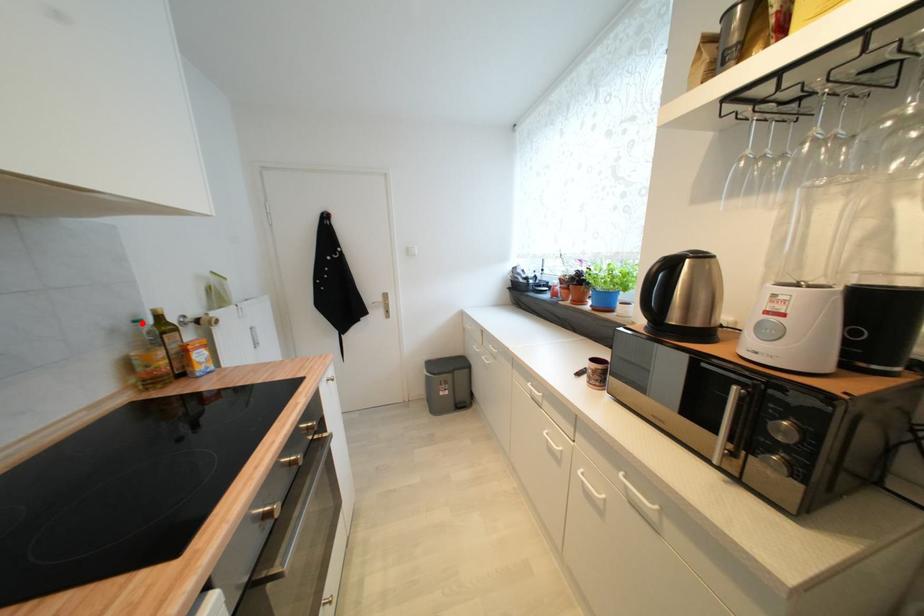
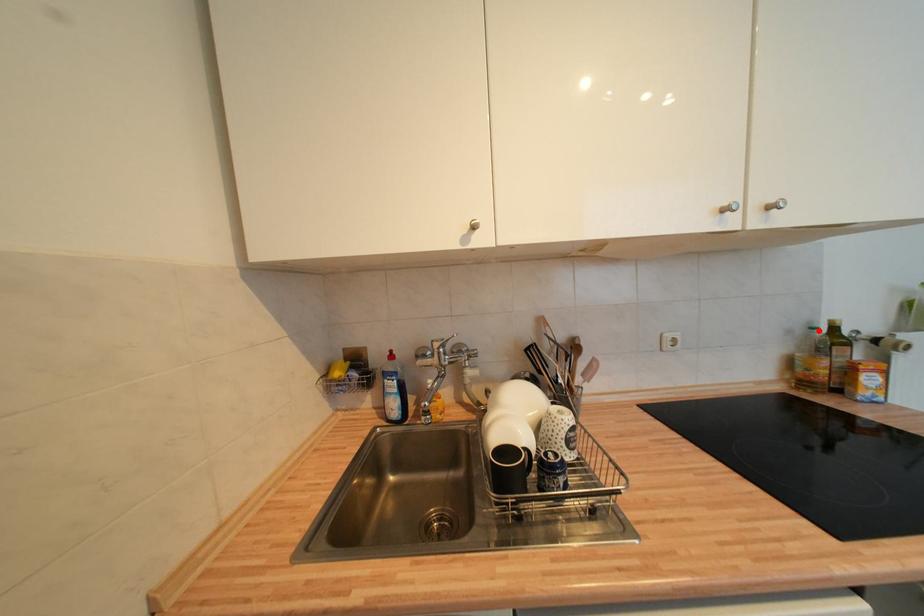
I am providing you with two images of the same scene from different viewpoints. A red point is marked on the first image and another point is marked on the second image. Is the red point in image1 aligned with the point shown in image2?

Yes